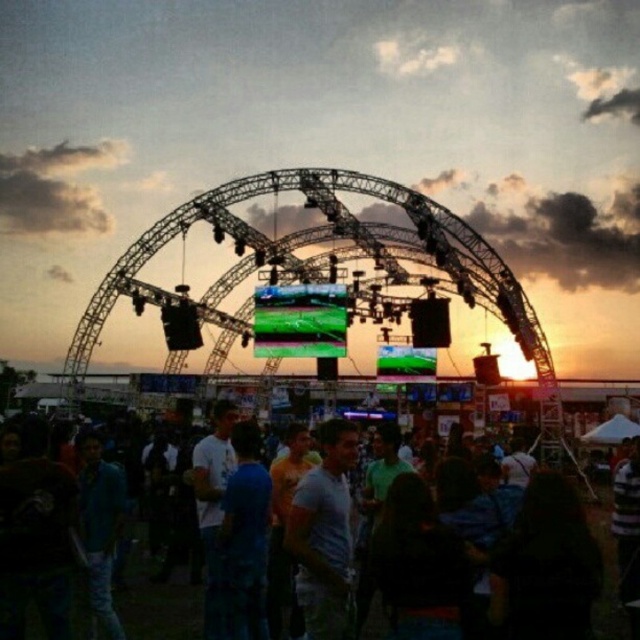
Question: Can you confirm if white cotton shirt at center is positioned above dark blue casual shirt at center?

Choices:
 (A) yes
 (B) no

Answer: (A)

Question: Does white cotton shirt at center appear on the left side of dark blue casual shirt at center?

Choices:
 (A) yes
 (B) no

Answer: (A)

Question: Which of the following is the farthest from the observer?

Choices:
 (A) dark blue casual shirt at center
 (B) white cotton shirt at center

Answer: (B)

Question: Which of the following is the closest to the observer?

Choices:
 (A) dark blue casual shirt at center
 (B) white cotton shirt at center

Answer: (A)

Question: Is white cotton shirt at center smaller than dark blue casual shirt at center?

Choices:
 (A) yes
 (B) no

Answer: (A)